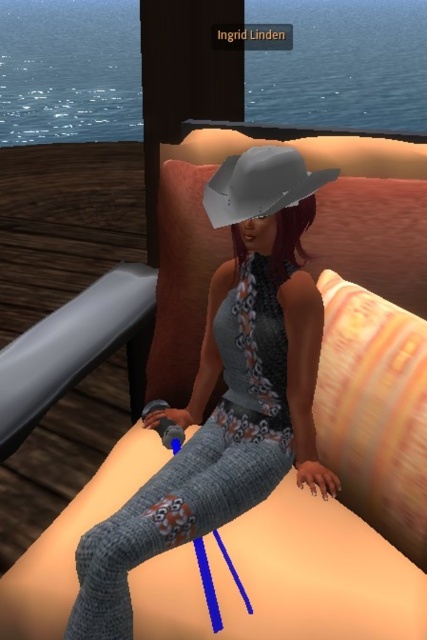
Question: Among these objects, which one is farthest from the camera?

Choices:
 (A) striped fabric pillow at right
 (B) knitted gray pants at center

Answer: (A)

Question: Among these objects, which one is farthest from the camera?

Choices:
 (A) striped fabric pillow at right
 (B) gray matte cowboy hat at center
 (C) knitted gray pants at center

Answer: (B)

Question: Which of the following is the farthest from the observer?

Choices:
 (A) gray matte cowboy hat at center
 (B) striped fabric pillow at right

Answer: (A)

Question: Where is knitted gray pants at center located in relation to gray matte cowboy hat at center in the image?

Choices:
 (A) right
 (B) left

Answer: (B)

Question: Considering the relative positions of knitted gray pants at center and striped fabric pillow at right in the image provided, where is knitted gray pants at center located with respect to striped fabric pillow at right?

Choices:
 (A) below
 (B) above

Answer: (B)

Question: Is striped fabric pillow at right further to camera compared to gray matte cowboy hat at center?

Choices:
 (A) yes
 (B) no

Answer: (B)